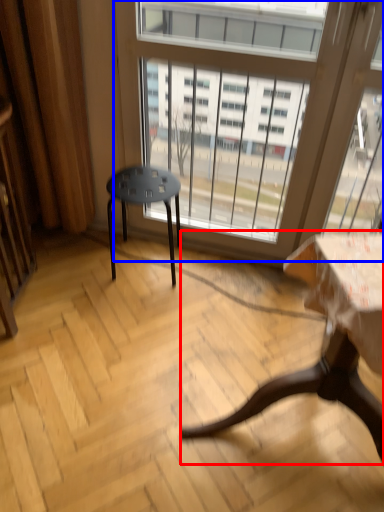
Question: Among these objects, which one is nearest to the camera, table (highlighted by a red box) or window (highlighted by a blue box)?

Choices:
 (A) table
 (B) window

Answer: (A)